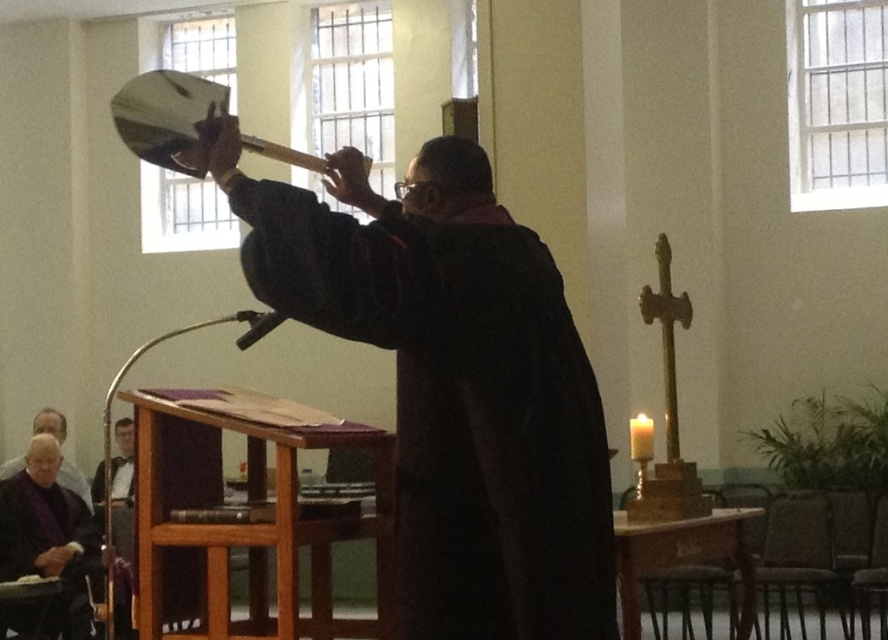
Question: Does black velvet robe at center appear on the right side of brown wooden podium at lower center?

Choices:
 (A) yes
 (B) no

Answer: (A)

Question: Does black velvet robe at center lie behind purple velvet robe at lower left?

Choices:
 (A) no
 (B) yes

Answer: (A)

Question: Which of these objects is positioned closest to the black velvet robe at center?

Choices:
 (A) brown wooden podium at lower center
 (B) purple velvet robe at lower left

Answer: (A)

Question: Does brown wooden podium at lower center lie in front of purple velvet robe at lower left?

Choices:
 (A) yes
 (B) no

Answer: (A)

Question: Which object is positioned farthest from the black velvet robe at center?

Choices:
 (A) purple velvet robe at lower left
 (B) brown wooden podium at lower center

Answer: (A)

Question: Among these objects, which one is farthest from the camera?

Choices:
 (A) black velvet robe at center
 (B) purple velvet robe at lower left

Answer: (B)